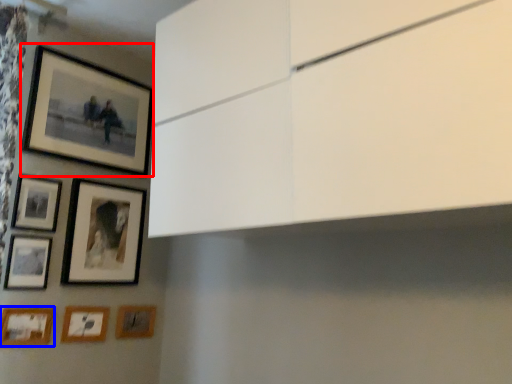
Question: Which point is closer to the camera, picture frame (highlighted by a red box) or picture frame (highlighted by a blue box)?

Choices:
 (A) picture frame
 (B) picture frame

Answer: (B)